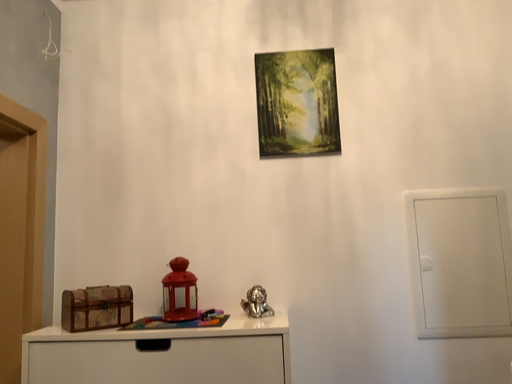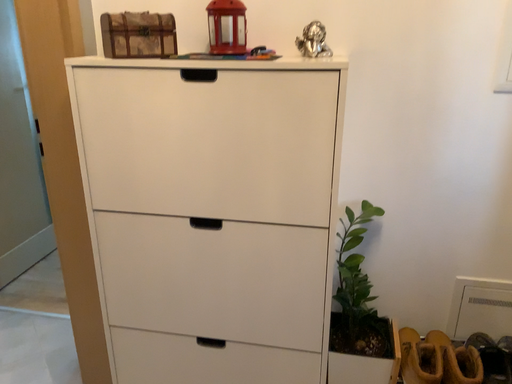
Question: How did the camera likely rotate when shooting the video?

Choices:
 (A) rotated left
 (B) rotated right

Answer: (A)